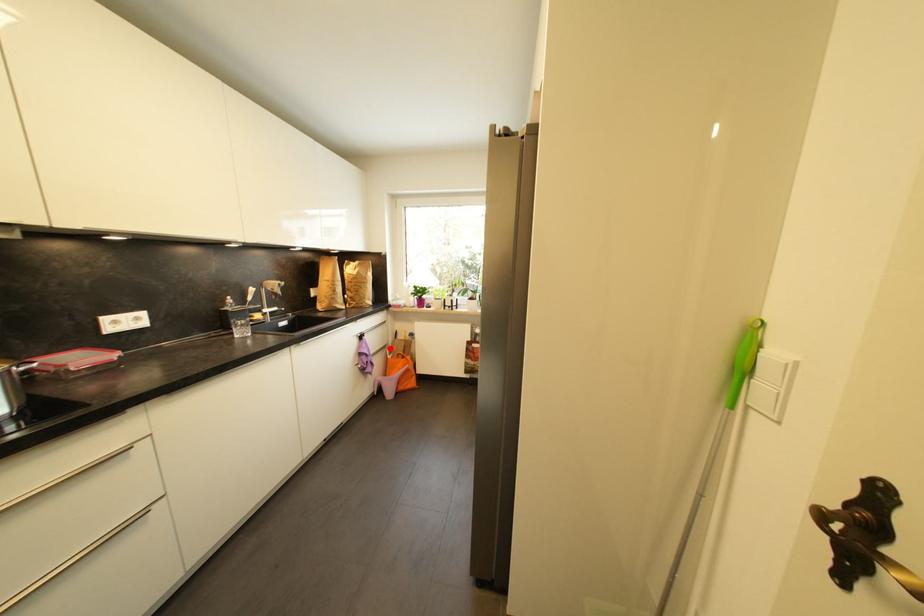
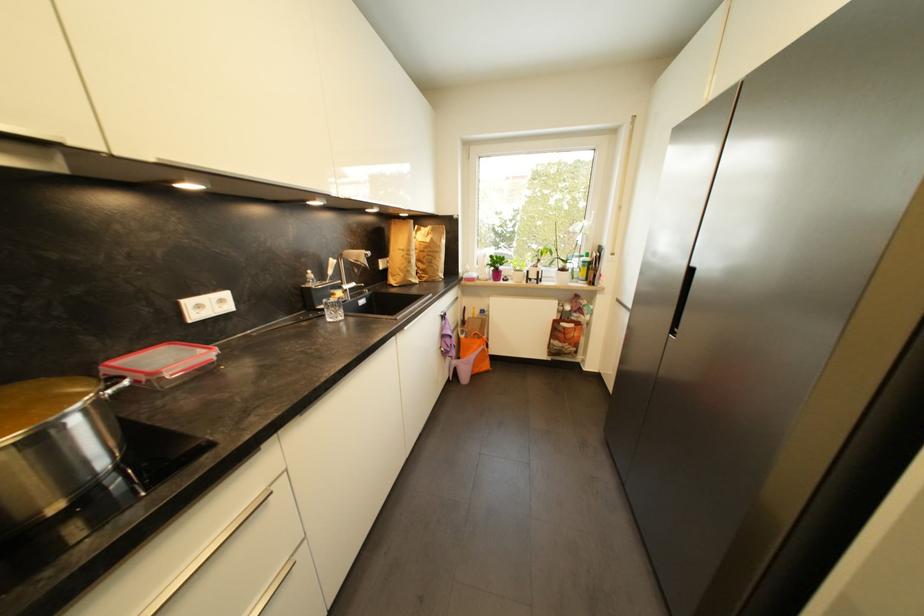
Question: I am providing you with two images of the same scene from different viewpoints. Image1 has a red point marked. In image2, the corresponding 3D location appears at what relative position? Reply with the corresponding letter.

Choices:
 (A) Closer
 (B) Farther

Answer: (A)